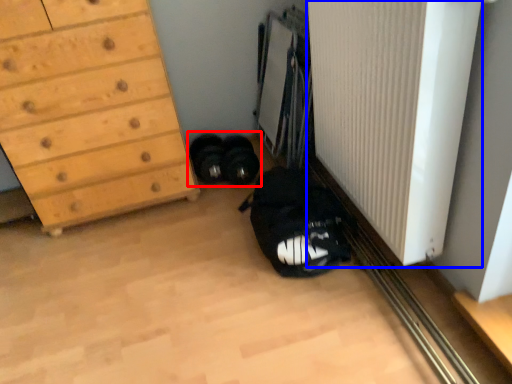
Question: Among these objects, which one is farthest to the camera, footwear (highlighted by a red box) or radiator (highlighted by a blue box)?

Choices:
 (A) footwear
 (B) radiator

Answer: (A)